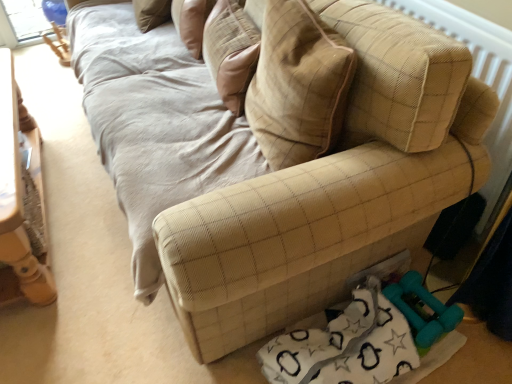
Question: Is beige quilted pillow at center closer to camera compared to teal rubber dumbbells at lower right?

Choices:
 (A) yes
 (B) no

Answer: (A)

Question: From a real-world perspective, is beige quilted pillow at center beneath teal rubber dumbbells at lower right?

Choices:
 (A) yes
 (B) no

Answer: (B)

Question: Is beige quilted pillow at center taller than teal rubber dumbbells at lower right?

Choices:
 (A) yes
 (B) no

Answer: (A)

Question: Is beige quilted pillow at center further to camera compared to teal rubber dumbbells at lower right?

Choices:
 (A) no
 (B) yes

Answer: (A)

Question: Is beige quilted pillow at center looking in the opposite direction of teal rubber dumbbells at lower right?

Choices:
 (A) no
 (B) yes

Answer: (A)

Question: Is beige quilted pillow at center bigger than teal rubber dumbbells at lower right?

Choices:
 (A) yes
 (B) no

Answer: (A)

Question: Is beige quilted pillow at center next to beige fabric radiator at upper right and touching it?

Choices:
 (A) no
 (B) yes

Answer: (A)

Question: Considering the relative positions of beige quilted pillow at center and beige fabric radiator at upper right in the image provided, is beige quilted pillow at center behind beige fabric radiator at upper right?

Choices:
 (A) yes
 (B) no

Answer: (B)

Question: Is beige quilted pillow at center far away from beige fabric radiator at upper right?

Choices:
 (A) no
 (B) yes

Answer: (A)

Question: Is beige quilted pillow at center smaller than beige fabric radiator at upper right?

Choices:
 (A) yes
 (B) no

Answer: (A)

Question: Does beige quilted pillow at center appear on the left side of beige fabric radiator at upper right?

Choices:
 (A) no
 (B) yes

Answer: (B)

Question: Can you confirm if beige quilted pillow at center is wider than beige fabric radiator at upper right?

Choices:
 (A) no
 (B) yes

Answer: (B)

Question: Can you confirm if beige quilted pillow at center is thinner than wooden table at left?

Choices:
 (A) yes
 (B) no

Answer: (A)